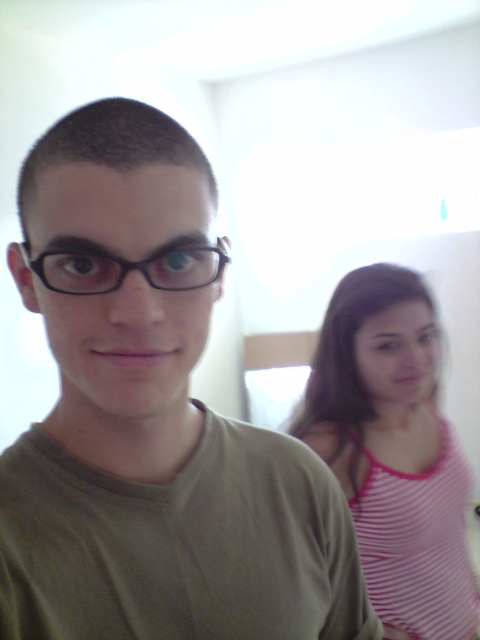
Measure the distance from pink striped tank top at right to black plastic glasses at center.

pink striped tank top at right and black plastic glasses at center are 33.78 inches apart from each other.

Can you confirm if pink striped tank top at right is positioned to the right of black plastic glasses at center?

Correct, you'll find pink striped tank top at right to the right of black plastic glasses at center.

Where is `pink striped tank top at right`? Image resolution: width=480 pixels, height=640 pixels. pink striped tank top at right is located at coordinates (394, 449).

Can you confirm if matte green shirt at center is wider than black plastic glasses at center?

Indeed, matte green shirt at center has a greater width compared to black plastic glasses at center.

Between matte green shirt at center and black plastic glasses at center, which one appears on the left side from the viewer's perspective?

Positioned to the left is black plastic glasses at center.

Is point (304, 621) positioned behind point (22, 250)?

Yes, point (304, 621) is behind point (22, 250).

Find the location of a particular element. matte green shirt at center is located at coordinates (152, 419).

Looking at this image, does matte green shirt at center appear over pink striped tank top at right?

Indeed, matte green shirt at center is positioned over pink striped tank top at right.

Who is lower down, matte green shirt at center or pink striped tank top at right?

Positioned lower is pink striped tank top at right.

This screenshot has height=640, width=480. Find the location of `matte green shirt at center`. matte green shirt at center is located at coordinates (152, 419).